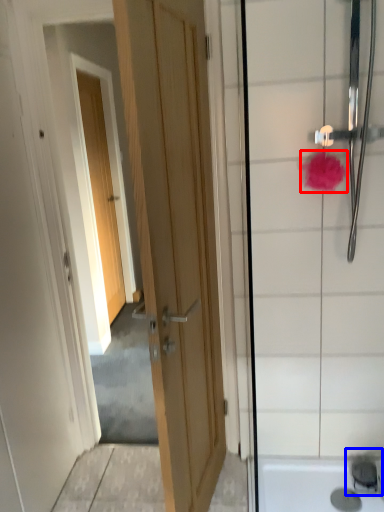
Question: Which of the following is the farthest to the observer, flower (highlighted by a red box) or faucet (highlighted by a blue box)?

Choices:
 (A) flower
 (B) faucet

Answer: (B)